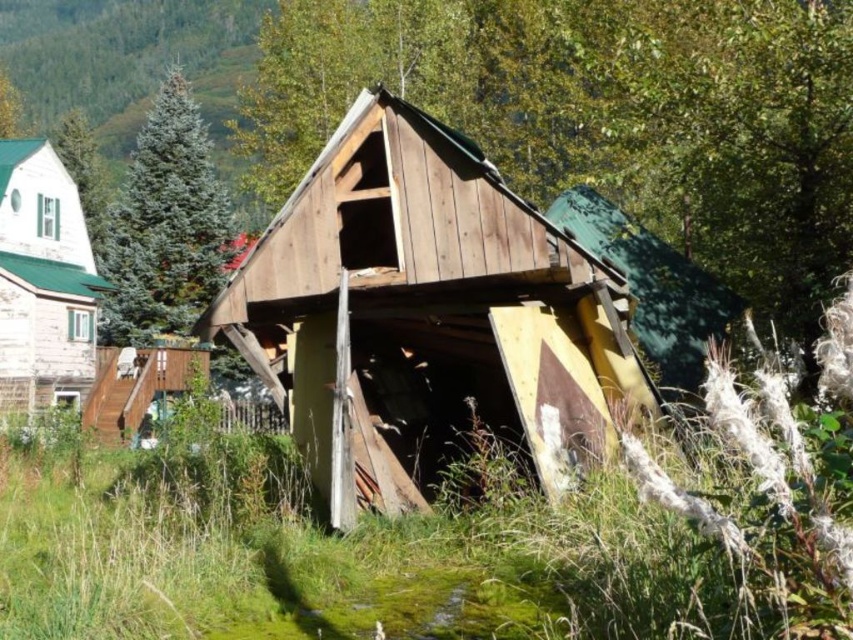
In the scene shown: You are standing in front of a rustic wooden shed surrounded by green grass. You notice two elements at the center of the image. Which one is closer to you, the green grass at center or the brown wood at center?

The green grass at center is in front of brown wood at center, so the green grass at center is closer to you.

You are standing in front of the shed and notice a specific point marked at coordinates (602, 115). What color is the material located at that exact point?

The material at point (602, 115) is brown wood.